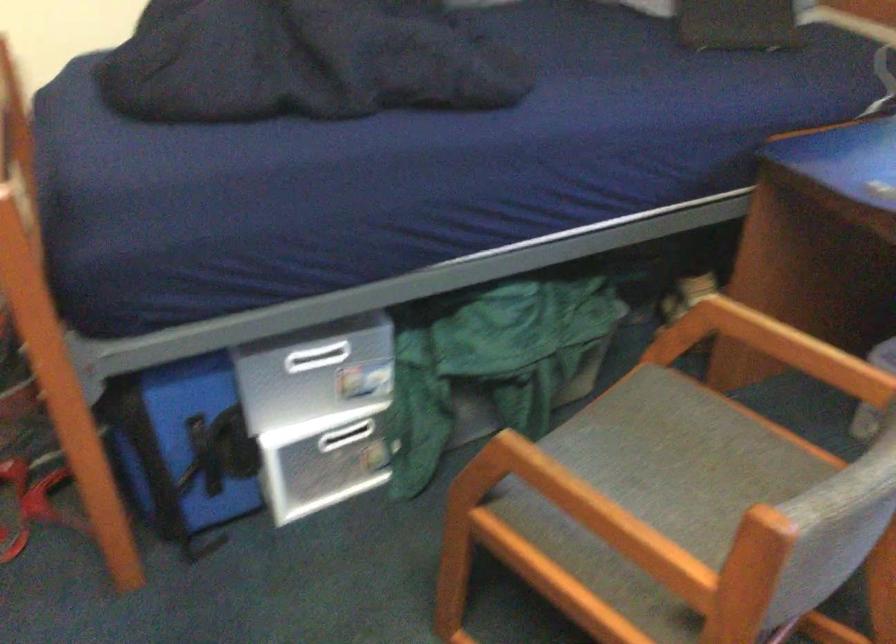
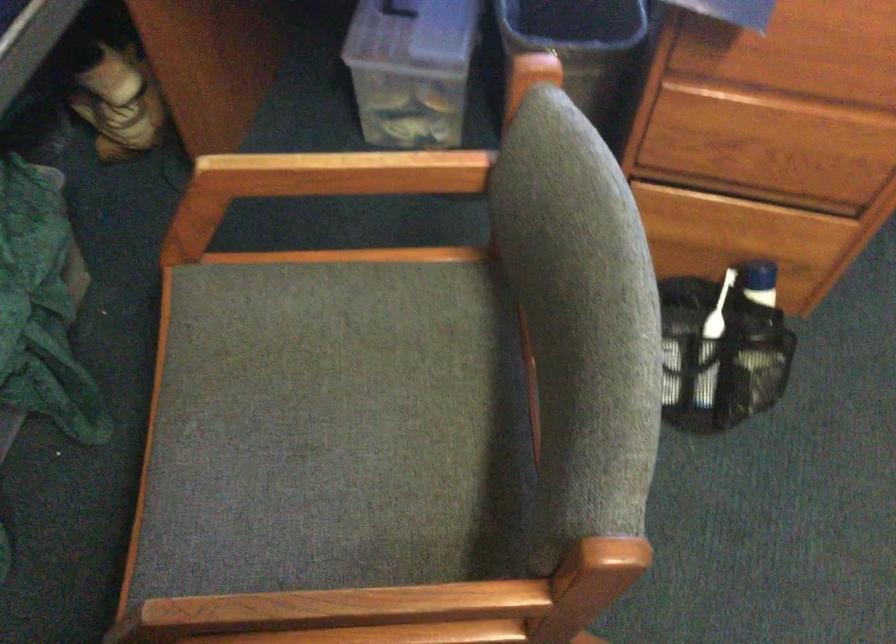
The first image is from the beginning of the video and the second image is from the end. How did the camera likely rotate when shooting the video?

The rotation direction of the camera is right-down.